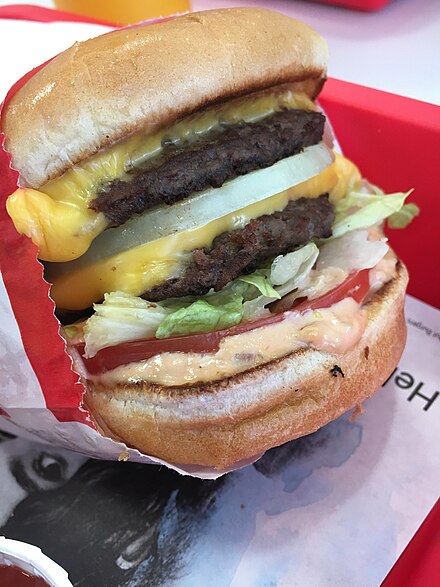
You are a GUI agent. You are given a task and a screenshot of the screen. Output one action in this format:
    pyautogui.click(x=<x>, y=<y>)
    Task: Click on the red tray
    The width and height of the screenshot is (440, 587).
    Given the screenshot: What is the action you would take?
    pyautogui.click(x=369, y=140)